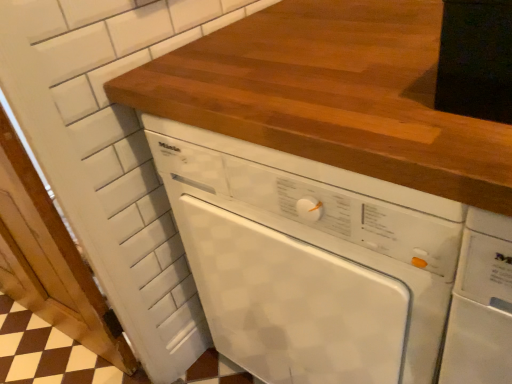
The image size is (512, 384). Describe the element at coordinates (309, 260) in the screenshot. I see `white glossy dishwasher at center` at that location.

Describe the element at coordinates (333, 95) in the screenshot. The image size is (512, 384). I see `wooden countertop at center` at that location.

You are a GUI agent. You are given a task and a screenshot of the screen. Output one action in this format:
    pyautogui.click(x=<x>, y=<y>)
    Task: Click on the white glossy dishwasher at center
    Image resolution: width=512 pixels, height=384 pixels.
    Given the screenshot: What is the action you would take?
    pyautogui.click(x=309, y=260)

Identify the location of countertop in front of the white painted wood door at left. (333, 95).

Is wooden countertop at center taller than white painted wood door at left?

In fact, wooden countertop at center may be shorter than white painted wood door at left.

Which of these two, wooden countertop at center or white painted wood door at left, is smaller?

wooden countertop at center.

Who is more distant, white painted wood door at left or wooden countertop at center?

white painted wood door at left is more distant.

The width and height of the screenshot is (512, 384). I want to click on door on the left of wooden countertop at center, so click(50, 259).

Is there a large distance between white painted wood door at left and wooden countertop at center?

No, white painted wood door at left is in close proximity to wooden countertop at center.

Considering the relative positions of white painted wood door at left and wooden countertop at center in the image provided, is white painted wood door at left to the right of wooden countertop at center from the viewer's perspective?

In fact, white painted wood door at left is to the left of wooden countertop at center.

Is white glossy dishwasher at center further to the viewer compared to white painted wood door at left?

No, it is not.

Could you tell me if white glossy dishwasher at center is turned towards white painted wood door at left?

No, white glossy dishwasher at center is not turned towards white painted wood door at left.

From the image's perspective, which one is positioned lower, white glossy dishwasher at center or white painted wood door at left?

From the image's view, white painted wood door at left is below.

Is wooden countertop at center not within white glossy dishwasher at center?

That's correct, wooden countertop at center is outside of white glossy dishwasher at center.

From the image's perspective, is wooden countertop at center located beneath white glossy dishwasher at center?

Actually, wooden countertop at center appears above white glossy dishwasher at center in the image.

Is wooden countertop at center not near white glossy dishwasher at center?

No, wooden countertop at center is not far from white glossy dishwasher at center.

From a real-world perspective, is white glossy dishwasher at center physically below wooden countertop at center?

Indeed, from a real-world perspective, white glossy dishwasher at center is positioned beneath wooden countertop at center.

How much distance is there between white glossy dishwasher at center and wooden countertop at center?

A distance of 21.41 centimeters exists between white glossy dishwasher at center and wooden countertop at center.

Which object is closer to the camera, white glossy dishwasher at center or wooden countertop at center?

wooden countertop at center is in front.

From the image's perspective, between white glossy dishwasher at center and wooden countertop at center, which one is located above?

wooden countertop at center.

Does white painted wood door at left have a lesser height compared to white glossy dishwasher at center?

Incorrect, the height of white painted wood door at left does not fall short of that of white glossy dishwasher at center.

Could you tell me if white painted wood door at left is turned towards white glossy dishwasher at center?

No, white painted wood door at left is not facing towards white glossy dishwasher at center.

Which point is more distant from viewer, (x=44, y=225) or (x=242, y=281)?

The point (x=44, y=225) is behind.

At what (x,y) coordinates should I click in order to perform the action: click on countertop on the right of white painted wood door at left. Please return your answer as a coordinate pair (x, y). Looking at the image, I should click on (333, 95).

Find the location of a particular element. countertop above the white painted wood door at left (from the image's perspective) is located at coordinates (333, 95).

From the image, which object appears to be nearer to wooden countertop at center, white painted wood door at left or white glossy dishwasher at center?

white glossy dishwasher at center is closer to wooden countertop at center.

Based on their spatial positions, is white painted wood door at left or wooden countertop at center closer to white glossy dishwasher at center?

wooden countertop at center.

Considering their positions, is wooden countertop at center positioned further to white glossy dishwasher at center than white painted wood door at left?

Based on the image, white painted wood door at left appears to be further to white glossy dishwasher at center.

Estimate the real-world distances between objects in this image. Which object is closer to white painted wood door at left, white glossy dishwasher at center or wooden countertop at center?

white glossy dishwasher at center lies closer to white painted wood door at left than the other object.

Estimate the real-world distances between objects in this image. Which object is further from white painted wood door at left, wooden countertop at center or white glossy dishwasher at center?

Among the two, wooden countertop at center is located further to white painted wood door at left.

Estimate the real-world distances between objects in this image. Which object is closer to wooden countertop at center, white glossy dishwasher at center or white painted wood door at left?

white glossy dishwasher at center lies closer to wooden countertop at center than the other object.

The width and height of the screenshot is (512, 384). I want to click on countertop situated between white painted wood door at left and white glossy dishwasher at center from left to right, so click(333, 95).